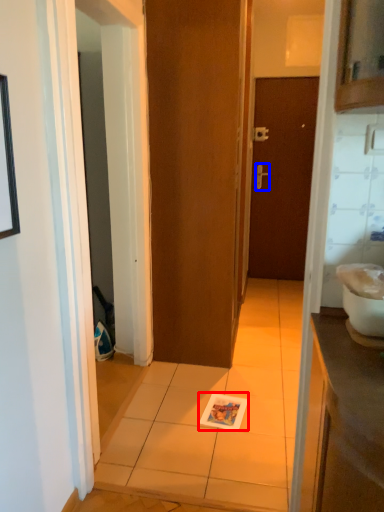
Question: Which object is closer to the camera taking this photo, magazine (highlighted by a red box) or door handle (highlighted by a blue box)?

Choices:
 (A) magazine
 (B) door handle

Answer: (A)